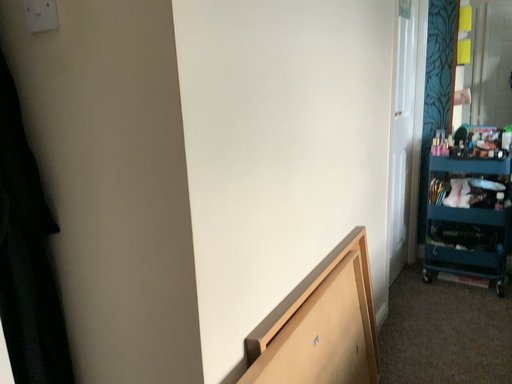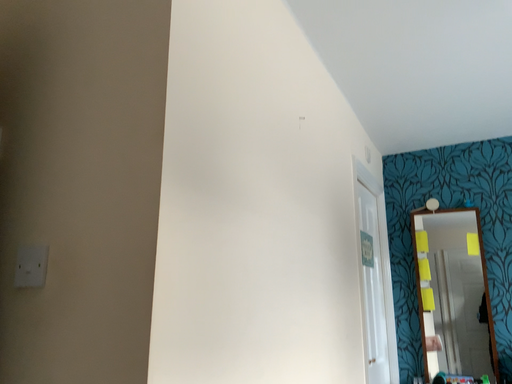
Question: How did the camera likely rotate when shooting the video?

Choices:
 (A) rotated downward
 (B) rotated upward

Answer: (B)